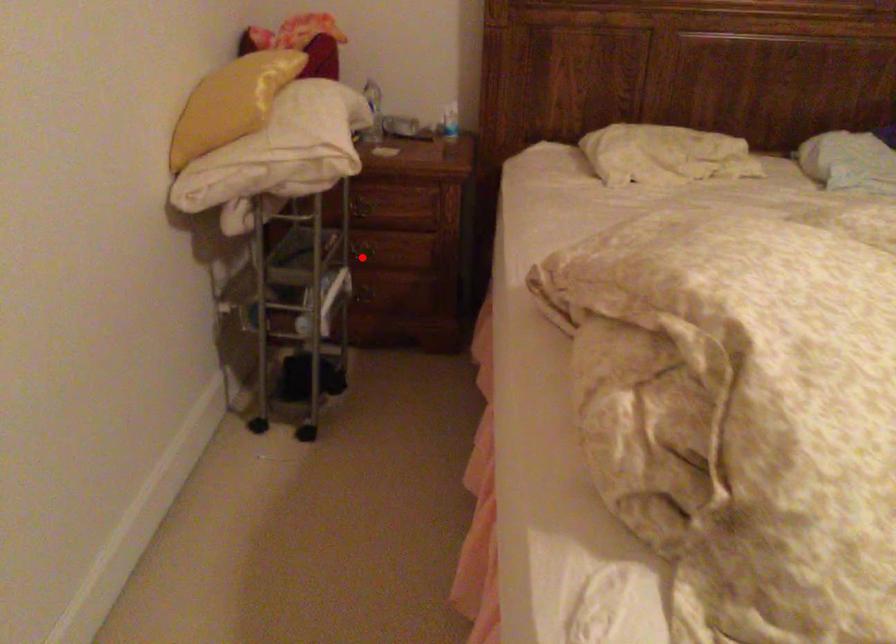
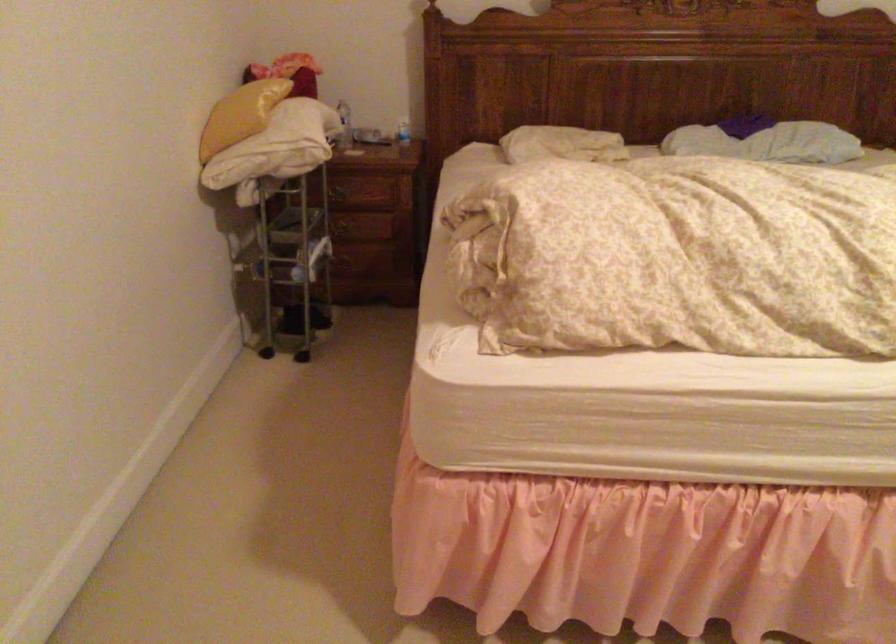
Question: I am providing you with two images of the same scene from different viewpoints. In image1, a red point is highlighted. Considering the same 3D point in image2, which of the following is correct?

Choices:
 (A) It is closer
 (B) It is farther

Answer: (B)